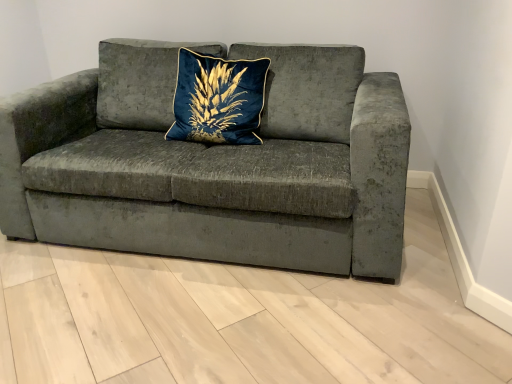
Question: In the image, is blue velvet pillow at center positioned in front of or behind velvet gray couch at center?

Choices:
 (A) front
 (B) behind

Answer: (B)

Question: From a real-world perspective, is blue velvet pillow at center positioned above or below velvet gray couch at center?

Choices:
 (A) below
 (B) above

Answer: (B)

Question: Does point (236, 82) appear closer or farther from the camera than point (384, 223)?

Choices:
 (A) farther
 (B) closer

Answer: (A)

Question: Is velvet gray couch at center in front of or behind blue velvet pillow at center in the image?

Choices:
 (A) behind
 (B) front

Answer: (B)

Question: In terms of size, does velvet gray couch at center appear bigger or smaller than blue velvet pillow at center?

Choices:
 (A) big
 (B) small

Answer: (A)

Question: Choose the correct answer: Is velvet gray couch at center inside blue velvet pillow at center or outside it?

Choices:
 (A) inside
 (B) outside

Answer: (B)

Question: Is point (x=160, y=218) closer or farther from the camera than point (x=195, y=137)?

Choices:
 (A) closer
 (B) farther

Answer: (A)